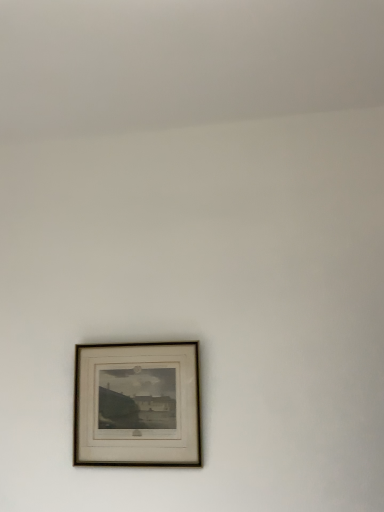
Where is `wooden frame at center`? wooden frame at center is located at coordinates (137, 405).

This screenshot has width=384, height=512. What do you see at coordinates (137, 405) in the screenshot?
I see `wooden frame at center` at bounding box center [137, 405].

Locate an element on the screen. The image size is (384, 512). wooden frame at center is located at coordinates (137, 405).